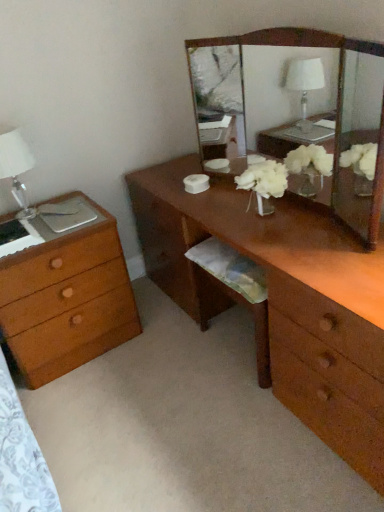
Question: Can you confirm if wooden chest of drawers at left is positioned to the left of wooden mirror at center?

Choices:
 (A) no
 (B) yes

Answer: (B)

Question: From a real-world perspective, does wooden chest of drawers at left stand above wooden mirror at center?

Choices:
 (A) yes
 (B) no

Answer: (B)

Question: Is wooden chest of drawers at left next to wooden mirror at center and touching it?

Choices:
 (A) yes
 (B) no

Answer: (B)

Question: Considering the relative sizes of wooden chest of drawers at left and wooden mirror at center in the image provided, is wooden chest of drawers at left taller than wooden mirror at center?

Choices:
 (A) yes
 (B) no

Answer: (A)

Question: Does wooden chest of drawers at left appear on the right side of wooden mirror at center?

Choices:
 (A) yes
 (B) no

Answer: (B)

Question: Would you say wooden chest of drawers at left is outside wooden mirror at center?

Choices:
 (A) yes
 (B) no

Answer: (A)

Question: From the image's perspective, is wooden mirror at center beneath white glass table lamp at left?

Choices:
 (A) no
 (B) yes

Answer: (A)

Question: Does wooden mirror at center come in front of white glass table lamp at left?

Choices:
 (A) yes
 (B) no

Answer: (A)

Question: Is wooden mirror at center thinner than white glass table lamp at left?

Choices:
 (A) yes
 (B) no

Answer: (A)

Question: From a real-world perspective, is wooden mirror at center physically above white glass table lamp at left?

Choices:
 (A) no
 (B) yes

Answer: (B)

Question: Would you say wooden mirror at center is a long distance from white glass table lamp at left?

Choices:
 (A) no
 (B) yes

Answer: (B)

Question: Is wooden mirror at center facing towards white glass table lamp at left?

Choices:
 (A) yes
 (B) no

Answer: (A)

Question: Is the position of brown wooden desk at center less distant than that of wooden chest of drawers at left?

Choices:
 (A) no
 (B) yes

Answer: (B)